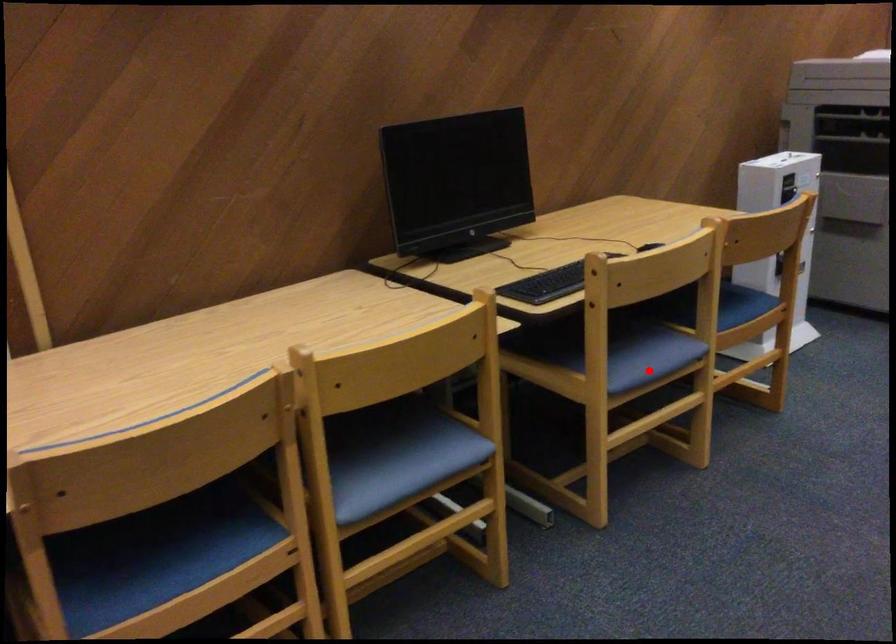
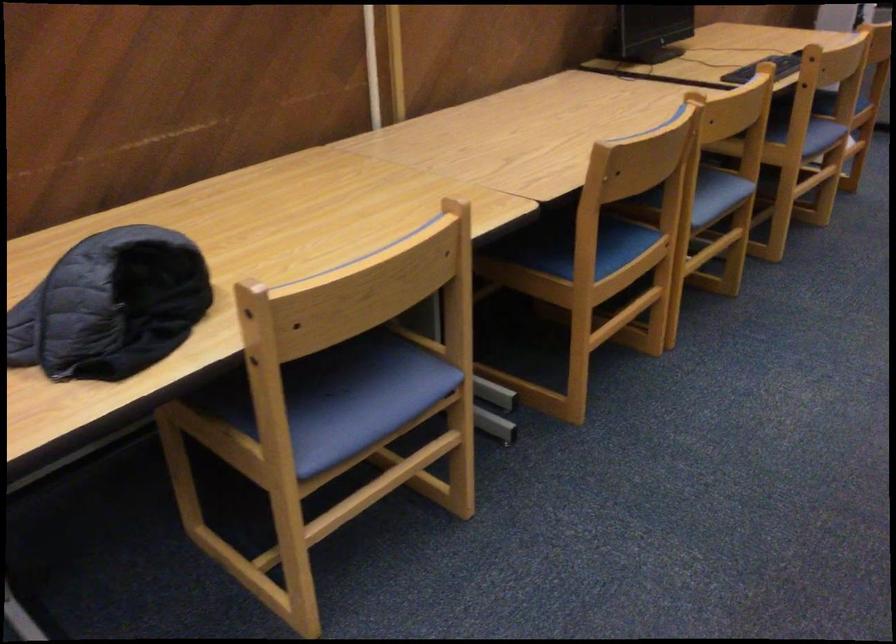
Where in the second image is the point corresponding to the highlighted location from the first image?

(821, 136)